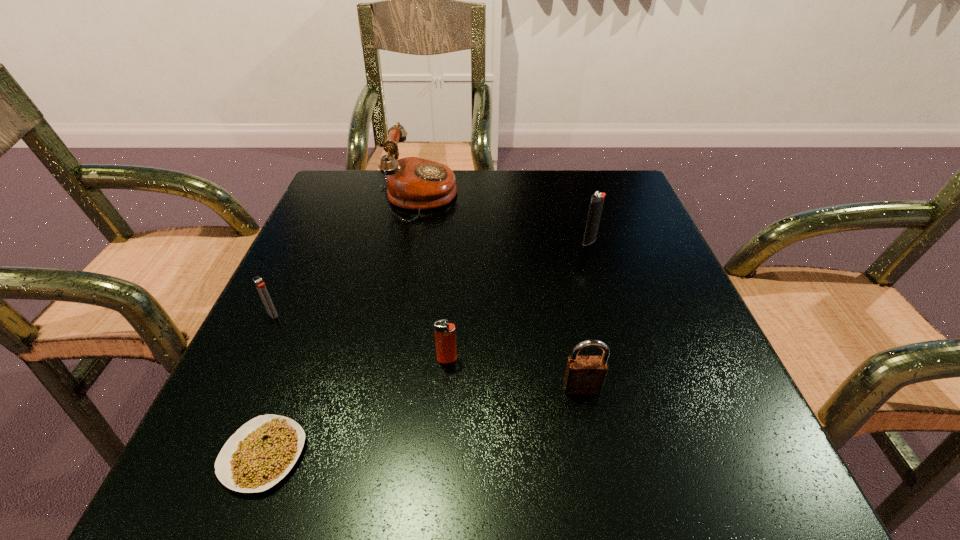
In order to click on vacant area that lies between the legume and the tallest object in this screenshot , I will do click(343, 327).

Locate which object is the third closest to the telephone. Please provide its 2D coordinates. Your answer should be formatted as a tuple, i.e. [(x, y)], where the tuple contains the x and y coordinates of a point satisfying the conditions above.

[(445, 336)]

At what (x,y) coordinates should I click in order to perform the action: click on object that is the fourth closest to the second farthest object. Please return your answer as a coordinate pair (x, y). Looking at the image, I should click on (260, 285).

You are a GUI agent. You are given a task and a screenshot of the screen. Output one action in this format:
    pyautogui.click(x=<x>, y=<y>)
    Task: Click on the igniter object that ranks as the closest to the fourth farthest object
    Image resolution: width=960 pixels, height=540 pixels.
    Given the screenshot: What is the action you would take?
    pyautogui.click(x=260, y=285)

Where is `igniter object that ranks as the closest to the rightmost igniter`? igniter object that ranks as the closest to the rightmost igniter is located at coordinates (445, 336).

You are a GUI agent. You are given a task and a screenshot of the screen. Output one action in this format:
    pyautogui.click(x=<x>, y=<y>)
    Task: Click on the vacant area that satisfies the following two spatial constraints: 1. on the back side of the nearest igniter; 2. on the left side of the rightmost object
    
    Given the screenshot: What is the action you would take?
    pyautogui.click(x=455, y=241)

The image size is (960, 540). In order to click on free space that satisfies the following two spatial constraints: 1. on the dial of the nearest igniter; 2. on the right side of the farthest object in this screenshot , I will do `click(393, 359)`.

You are a GUI agent. You are given a task and a screenshot of the screen. Output one action in this format:
    pyautogui.click(x=<x>, y=<y>)
    Task: Click on the free spot that satisfies the following two spatial constraints: 1. on the dial of the telephone; 2. on the front side of the leftmost object
    
    Given the screenshot: What is the action you would take?
    pyautogui.click(x=400, y=314)

This screenshot has width=960, height=540. I want to click on free region that satisfies the following two spatial constraints: 1. on the dial of the farthest object; 2. on the right side of the rightmost object, so click(x=414, y=241).

Find the location of `free location that satisfies the following two spatial constraints: 1. on the dial of the tallest object; 2. on the back side of the rightmost igniter`. free location that satisfies the following two spatial constraints: 1. on the dial of the tallest object; 2. on the back side of the rightmost igniter is located at coordinates (414, 241).